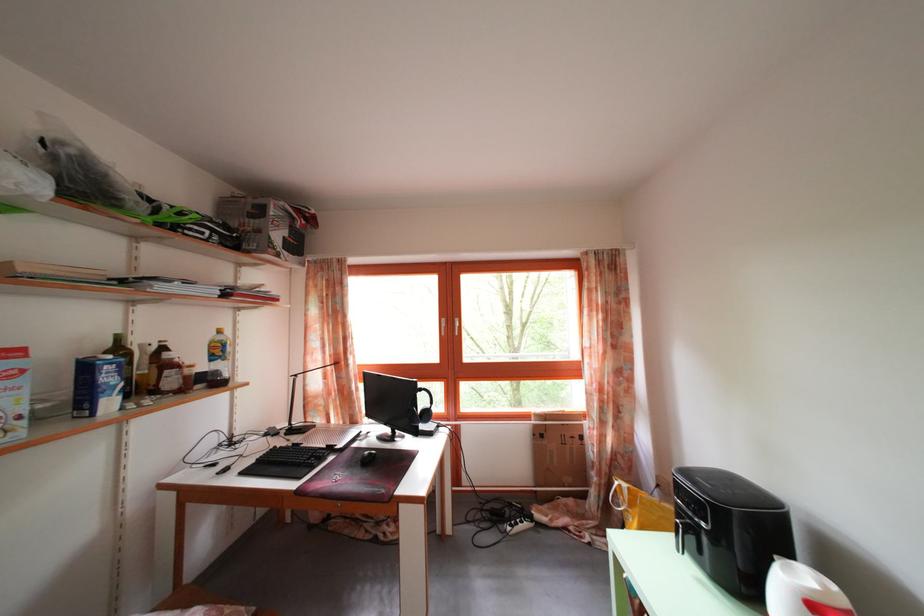
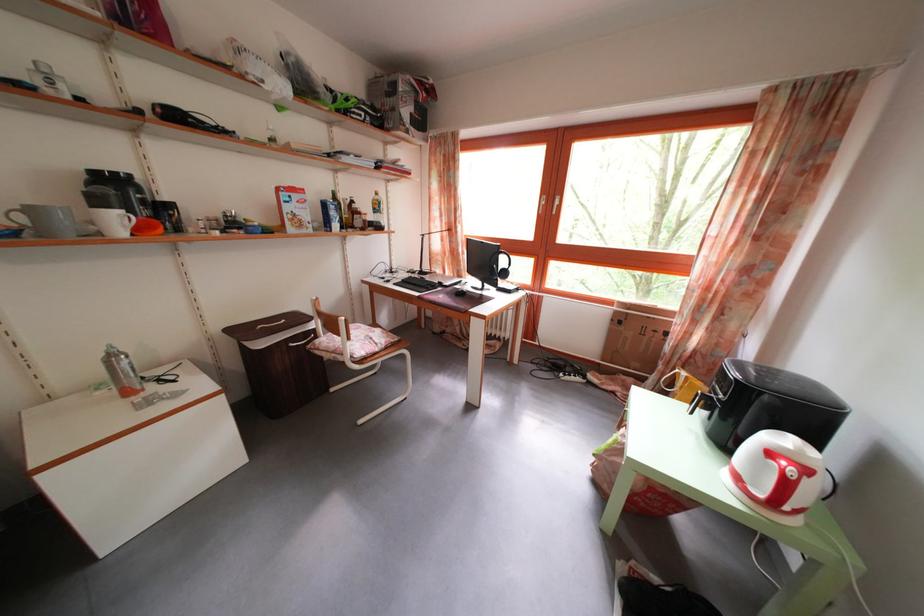
The point at (348, 458) is marked in the first image. Where is the corresponding point in the second image?

(454, 294)